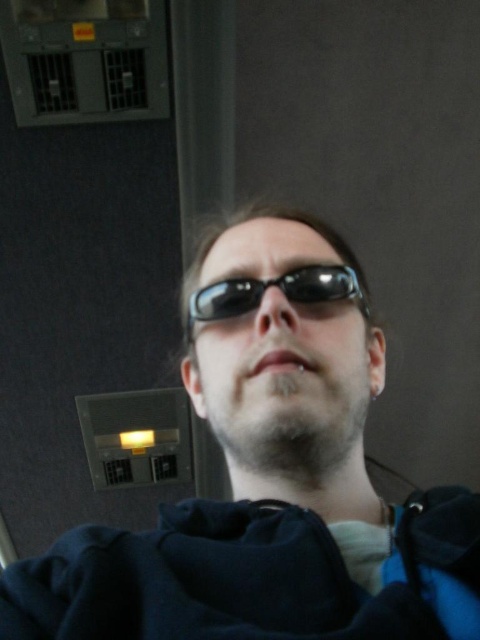
You are an engineer inspecting a control panel in a dimly lit room. You notice a point marked at coordinates (269, 477). What object is located at this point?

The point at coordinates (269, 477) marks the matte black sunglasses at center.

You are trying to choose between the matte black sunglasses at center and the black reflective sunglasses at center based on their size. Which pair has a wider frame?

The matte black sunglasses at center has a larger width than the black reflective sunglasses at center, so the matte black sunglasses at center has a wider frame.

You are a security guard in the room and need to inspect both the matte black sunglasses at center and the black reflective sunglasses at center. Which one is on the left side when facing the person?

The matte black sunglasses at center is to the left of the black reflective sunglasses at center.